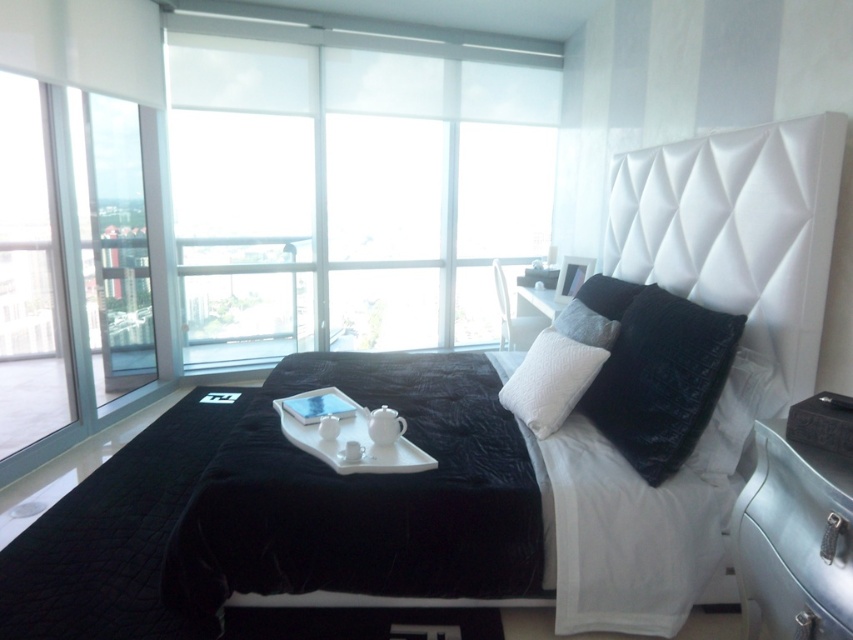
You are planning to move the metallic silver dresser at lower right to the space next to the velvet black bed at center. Based on their sizes, will the dresser fit next to the bed without overlapping?

The velvet black bed at center is wider than the metallic silver dresser at lower right. Since the bed is wider, there should be enough space to place the dresser next to it without overlapping, provided the available space next to the bed is sufficient.